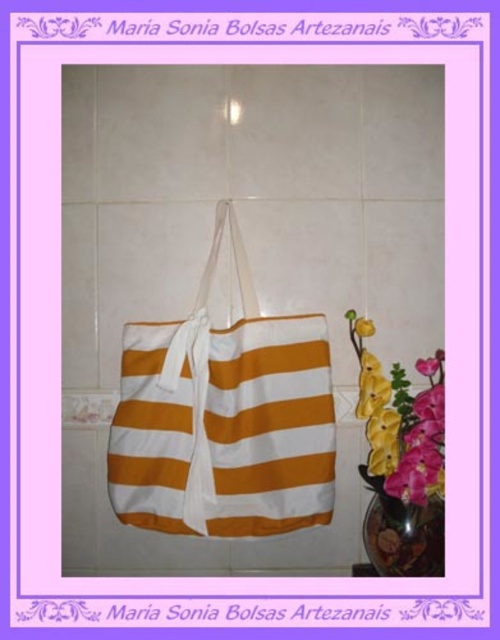
You are organizing a gift basket and need to place both the white cotton tote at center and the yellow fabric flower at right into a box. The box can only fit items that are arranged side by side horizontally. Based on their positions in the image, can you determine if they can fit without overlapping?

The white cotton tote at center is to the left of yellow fabric flower at right, so they are already positioned side by side horizontally. Therefore, they can fit into the box without overlapping.

You are an interior designer planning to place a decorative item between the white cotton tote at center and the yellow fabric flower at right. The item you want to place is 9 inches wide. Will it fit in the space between them?

The distance between the white cotton tote at center and the yellow fabric flower at right is 8.60 inches. Since the decorative item is 9 inches wide, it will not fit in the space between them as it is slightly wider than the available gap.

You are an interior designer arranging items on a wall. You have a white cotton tote at center and a yellow fabric flower at right. If you want to place a small picture frame between them, where should you position it to ensure it sits between the two items without overlapping either?

The white cotton tote at center is in front of the yellow fabric flower at right, so you should place the small picture frame between them in the space between the white cotton tote at center and the yellow fabric flower at right, ensuring it doesn not overlap either item.